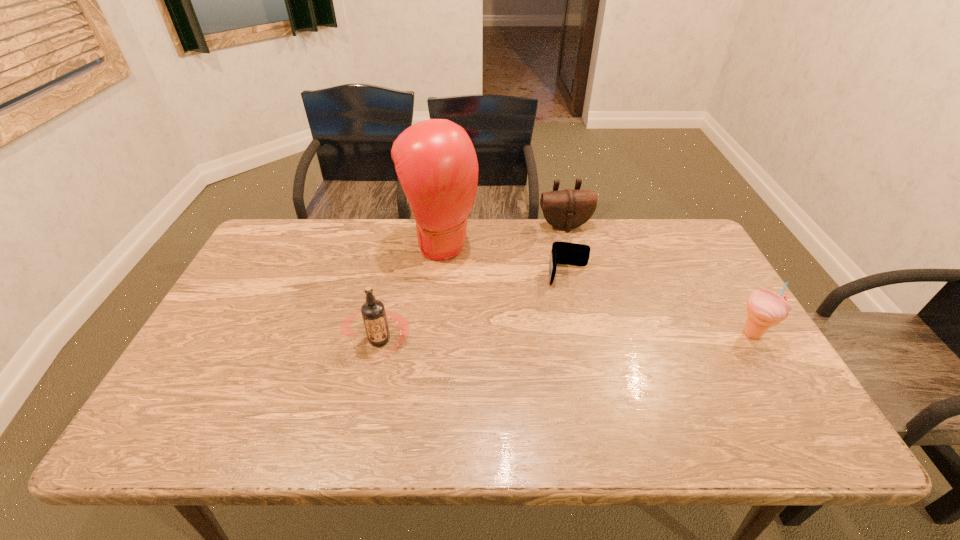
Where is `vacant space on the desktop that is between the root beer and the icecream and is positioned on the outer surface of the wallet`? The image size is (960, 540). vacant space on the desktop that is between the root beer and the icecream and is positioned on the outer surface of the wallet is located at coordinates (568, 336).

Where is `free spot on the desktop that is between the root beer and the icecream and is positioned on the striking surface of the boxing glove`? Image resolution: width=960 pixels, height=540 pixels. free spot on the desktop that is between the root beer and the icecream and is positioned on the striking surface of the boxing glove is located at coordinates (522, 338).

Locate an element on the screen. The height and width of the screenshot is (540, 960). free spot on the desktop that is between the root beer and the rightmost object and is positioned with the flap open on the pouch is located at coordinates (608, 336).